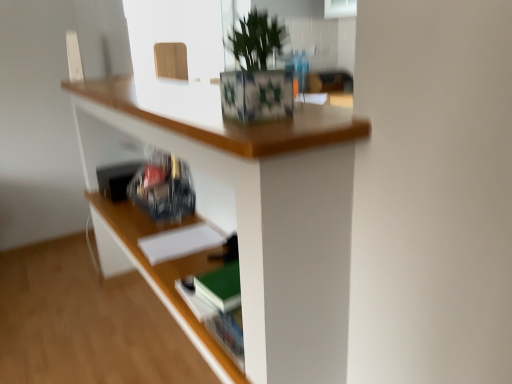
Question: Is white matte paper at center smaller than green leafy plant at upper center?

Choices:
 (A) no
 (B) yes

Answer: (B)

Question: Can you confirm if white matte paper at center is positioned to the right of green leafy plant at upper center?

Choices:
 (A) yes
 (B) no

Answer: (B)

Question: Does white matte paper at center come behind green leafy plant at upper center?

Choices:
 (A) no
 (B) yes

Answer: (B)

Question: From a real-world perspective, is white matte paper at center under green leafy plant at upper center?

Choices:
 (A) no
 (B) yes

Answer: (B)

Question: Is white matte paper at center bigger than green leafy plant at upper center?

Choices:
 (A) no
 (B) yes

Answer: (A)

Question: Is white matte paper at center taller or shorter than green leafy plant at upper center?

Choices:
 (A) tall
 (B) short

Answer: (B)

Question: Is point [220, 238] closer or farther from the camera than point [284, 34]?

Choices:
 (A) closer
 (B) farther

Answer: (A)

Question: From a real-world perspective, is white matte paper at center positioned above or below green leafy plant at upper center?

Choices:
 (A) above
 (B) below

Answer: (B)

Question: In the image, is white matte paper at center on the left side or the right side of green leafy plant at upper center?

Choices:
 (A) right
 (B) left

Answer: (B)

Question: Choose the correct answer: Is wooden frame at upper center inside green leafy plant at upper center or outside it?

Choices:
 (A) inside
 (B) outside

Answer: (B)

Question: Does point (221, 51) appear closer or farther from the camera than point (265, 115)?

Choices:
 (A) farther
 (B) closer

Answer: (A)

Question: In terms of height, does wooden frame at upper center look taller or shorter compared to green leafy plant at upper center?

Choices:
 (A) short
 (B) tall

Answer: (B)

Question: From a real-world perspective, is wooden frame at upper center physically located above or below green leafy plant at upper center?

Choices:
 (A) above
 (B) below

Answer: (A)

Question: From a real-world perspective, relative to wooden desk at upper center, is wooden frame at upper center vertically above or below?

Choices:
 (A) above
 (B) below

Answer: (A)

Question: Is wooden frame at upper center wider or thinner than wooden desk at upper center?

Choices:
 (A) thin
 (B) wide

Answer: (A)